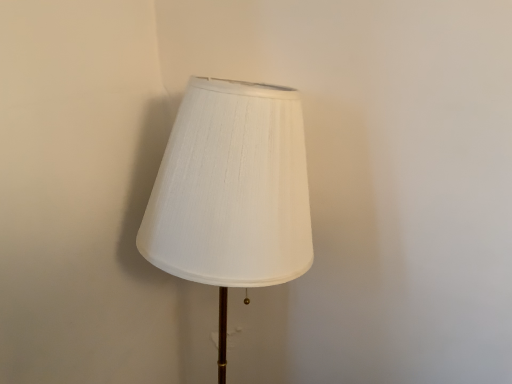
What do you see at coordinates (231, 192) in the screenshot? I see `white fabric lampshade at center` at bounding box center [231, 192].

You are a GUI agent. You are given a task and a screenshot of the screen. Output one action in this format:
    pyautogui.click(x=<x>, y=<y>)
    Task: Click on the white fabric lampshade at center
    The width and height of the screenshot is (512, 384).
    Given the screenshot: What is the action you would take?
    pyautogui.click(x=231, y=192)

Where is `white fabric lampshade at center`? This screenshot has width=512, height=384. white fabric lampshade at center is located at coordinates (231, 192).